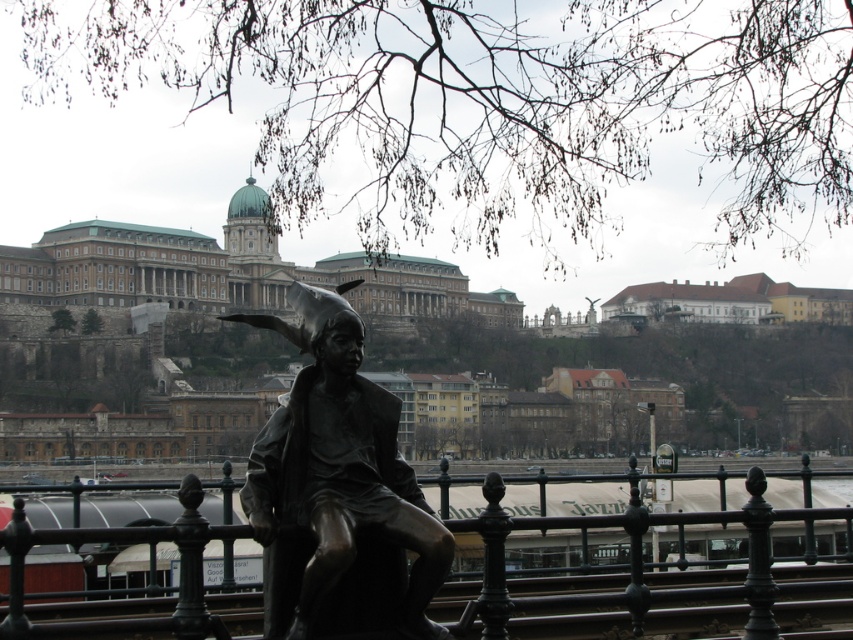
Is bronze statue at center to the left of bronze metal rail at center from the viewer's perspective?

Indeed, bronze statue at center is positioned on the left side of bronze metal rail at center.

Between bronze statue at center and bronze metal rail at center, which one has more height?

Standing taller between the two is bronze metal rail at center.

Who is more forward, [392,588] or [500,570]?

Point [500,570] is more forward.

Locate an element on the screen. This screenshot has width=853, height=640. bronze statue at center is located at coordinates (338, 492).

Is bronze statue at center bigger than brown stone palace at upper center?

No.

Which is above, bronze statue at center or brown stone palace at upper center?

brown stone palace at upper center

Does point (372, 611) lie behind point (123, 292)?

That is False.

In order to click on bronze statue at center in this screenshot , I will do `click(338, 492)`.

Is brown stone palace at upper center bigger than bronze metal rail at center?

Yes.

This screenshot has width=853, height=640. What do you see at coordinates (231, 272) in the screenshot?
I see `brown stone palace at upper center` at bounding box center [231, 272].

Between point (399, 291) and point (570, 595), which one is positioned behind?

Positioned behind is point (399, 291).

You are a GUI agent. You are given a task and a screenshot of the screen. Output one action in this format:
    pyautogui.click(x=<x>, y=<y>)
    Task: Click on the brown stone palace at upper center
    This screenshot has width=853, height=640.
    Given the screenshot: What is the action you would take?
    pyautogui.click(x=231, y=272)